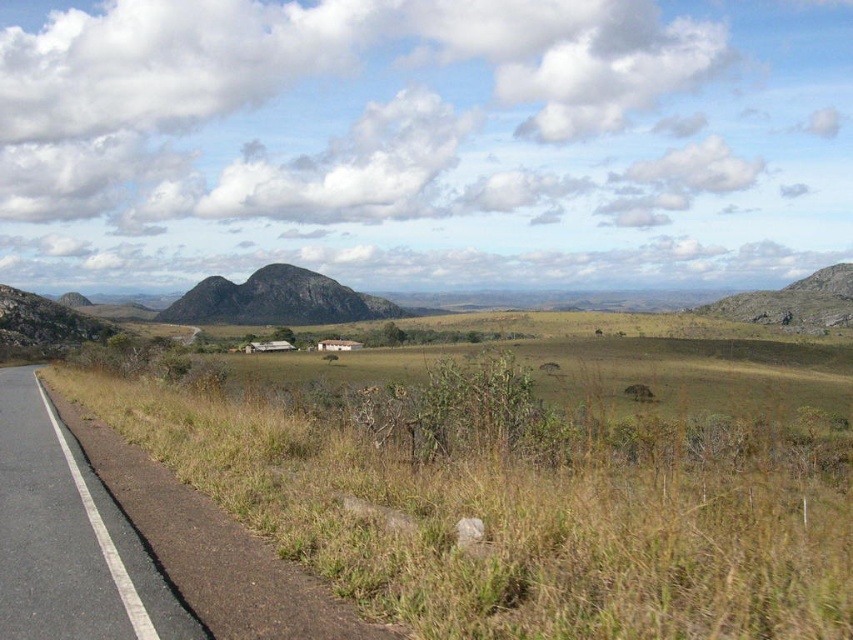
Question: Which point is closer to the camera?

Choices:
 (A) (334, 400)
 (B) (123, 577)

Answer: (B)

Question: Which object appears closest to the camera in this image?

Choices:
 (A) brown grassland at lower left
 (B) dark gray rock formation at center

Answer: (A)

Question: Does brown grassland at lower left appear on the right side of dark gray rock formation at center?

Choices:
 (A) no
 (B) yes

Answer: (B)

Question: Does brown grassland at lower left have a smaller size compared to black asphalt road at left?

Choices:
 (A) no
 (B) yes

Answer: (A)

Question: Is black asphalt road at left thinner than dark gray rock formation at center?

Choices:
 (A) no
 (B) yes

Answer: (B)

Question: Estimate the real-world distances between objects in this image. Which object is farther from the brown grassland at lower left?

Choices:
 (A) dark gray rock formation at center
 (B) black asphalt road at left

Answer: (A)